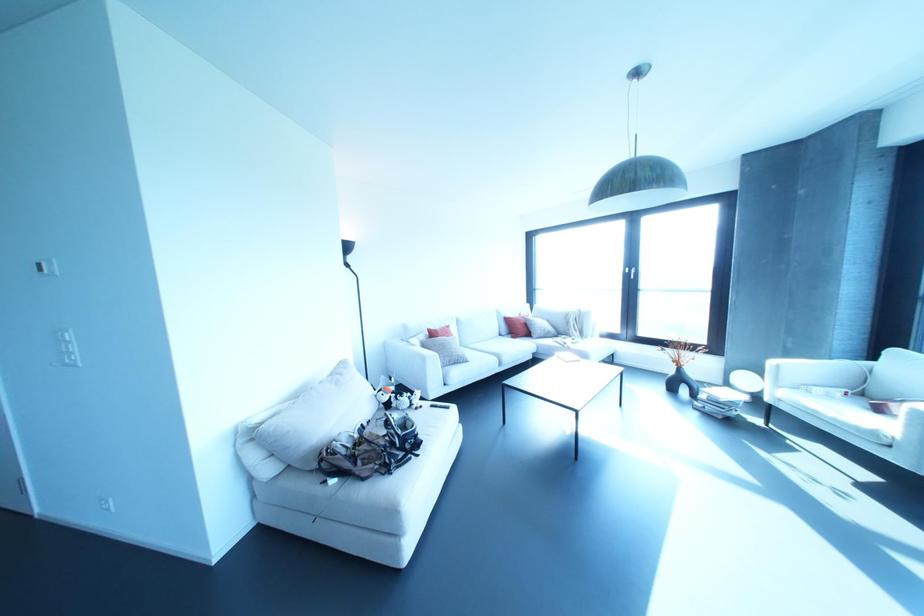
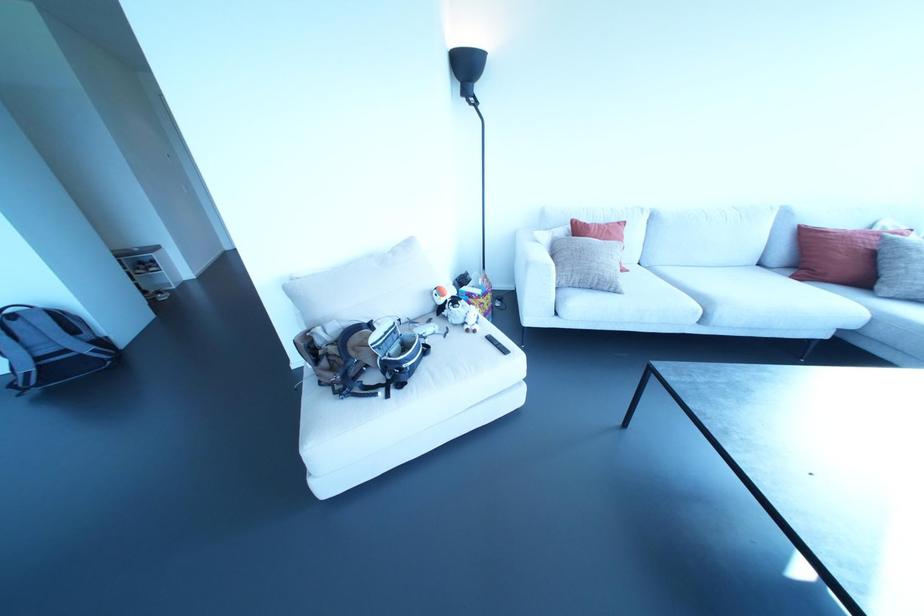
Locate, in the second image, the point that corresponds to pixel 525 323 in the first image.

(872, 254)